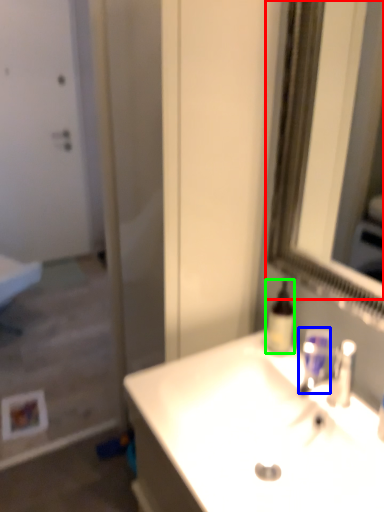
Question: Which is farther away from mirror (highlighted by a red box)? mouthwash (highlighted by a blue box) or mouthwash (highlighted by a green box)?

Choices:
 (A) mouthwash
 (B) mouthwash

Answer: (A)